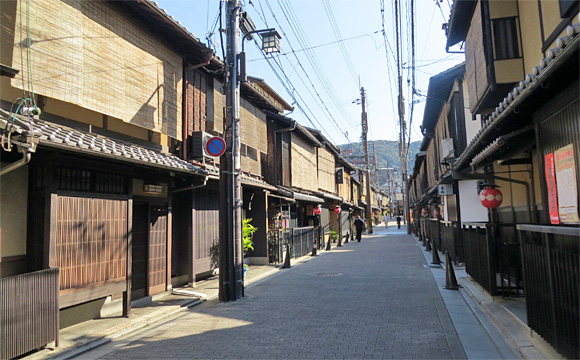
Find the location of a particular element. The image size is (580, 360). wires is located at coordinates coord(292,58).